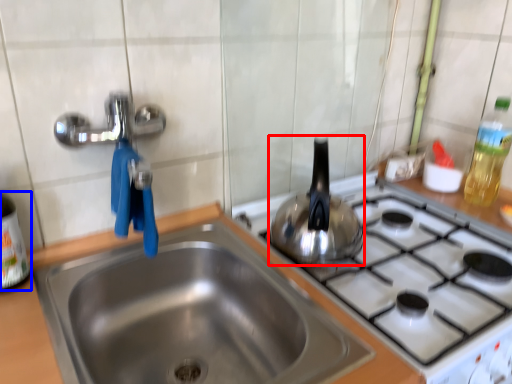
Question: Which point is further to the camera, tea pot (highlighted by a red box) or bottle (highlighted by a blue box)?

Choices:
 (A) tea pot
 (B) bottle

Answer: (A)